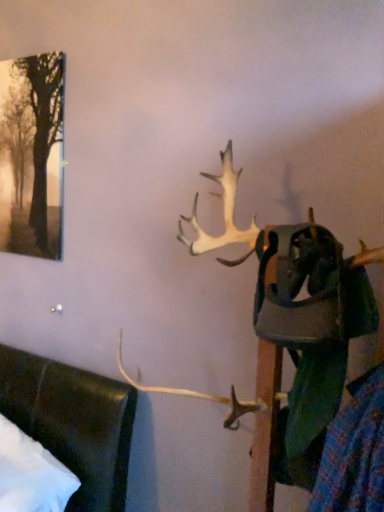
Find the location of a particular element. white antler at upper center is located at coordinates click(303, 320).

The width and height of the screenshot is (384, 512). What do you see at coordinates (303, 320) in the screenshot?
I see `white antler at upper center` at bounding box center [303, 320].

Describe the element at coordinates (43, 128) in the screenshot. I see `silvery metallic tree at upper left` at that location.

Locate an element on the screen. The height and width of the screenshot is (512, 384). silvery metallic tree at upper left is located at coordinates (43, 128).

What is the approximate width of silvery metallic tree at upper left?

silvery metallic tree at upper left is 5.65 centimeters wide.

At what (x,y) coordinates should I click in order to perform the action: click on white antler at upper center. Please return your answer as a coordinate pair (x, y). The width and height of the screenshot is (384, 512). Looking at the image, I should click on (303, 320).

Which is more to the left, white antler at upper center or silvery metallic tree at upper left?

Positioned to the left is silvery metallic tree at upper left.

Consider the image. Considering the positions of objects white antler at upper center and silvery metallic tree at upper left in the image provided, who is behind, white antler at upper center or silvery metallic tree at upper left?

silvery metallic tree at upper left.

Is point (196, 194) farther from camera compared to point (42, 161)?

No, it is not.

From the image's perspective, relative to silvery metallic tree at upper left, is white antler at upper center above or below?

white antler at upper center is situated lower than silvery metallic tree at upper left in the image.

From a real-world perspective, who is located lower, white antler at upper center or silvery metallic tree at upper left?

white antler at upper center.

In the scene shown: Does white antler at upper center have a lesser width compared to silvery metallic tree at upper left?

No.

Which of these two, white antler at upper center or silvery metallic tree at upper left, stands shorter?

Standing shorter between the two is silvery metallic tree at upper left.

Is white antler at upper center bigger or smaller than silvery metallic tree at upper left?

Answer: In the image, white antler at upper center appears to be larger than silvery metallic tree at upper left.

From the picture: Does white antler at upper center contain silvery metallic tree at upper left?

No, silvery metallic tree at upper left is not a part of white antler at upper center.

Is white antler at upper center not near silvery metallic tree at upper left?

That's right, there is a large distance between white antler at upper center and silvery metallic tree at upper left.

Is white antler at upper center facing towards silvery metallic tree at upper left?

No, white antler at upper center is not turned towards silvery metallic tree at upper left.

What's the angular difference between white antler at upper center and silvery metallic tree at upper left's facing directions?

The facing directions of white antler at upper center and silvery metallic tree at upper left are 0.00481 degrees apart.

How much distance is there between white antler at upper center and silvery metallic tree at upper left?

They are 1.02 meters apart.

At what (x,y) coordinates should I click in order to perform the action: click on tree behind the white antler at upper center. Please return your answer as a coordinate pair (x, y). Image resolution: width=384 pixels, height=512 pixels. Looking at the image, I should click on (43, 128).

Between silvery metallic tree at upper left and white antler at upper center, which one appears on the right side from the viewer's perspective?

From the viewer's perspective, white antler at upper center appears more on the right side.

Considering the positions of objects silvery metallic tree at upper left and white antler at upper center in the image provided, who is behind, silvery metallic tree at upper left or white antler at upper center?

Positioned behind is silvery metallic tree at upper left.

Does point (36, 137) come behind point (288, 311)?

Yes, it is behind point (288, 311).

From the image's perspective, is silvery metallic tree at upper left on white antler at upper center?

Yes, from the image's perspective, silvery metallic tree at upper left is on top of white antler at upper center.

From a real-world perspective, who is located lower, silvery metallic tree at upper left or white antler at upper center?

In real-world perspective, white antler at upper center is lower.

In the scene shown: Considering the sizes of objects silvery metallic tree at upper left and white antler at upper center in the image provided, who is thinner, silvery metallic tree at upper left or white antler at upper center?

silvery metallic tree at upper left.

Does silvery metallic tree at upper left have a greater height compared to white antler at upper center?

In fact, silvery metallic tree at upper left may be shorter than white antler at upper center.

Considering the sizes of objects silvery metallic tree at upper left and white antler at upper center in the image provided, who is bigger, silvery metallic tree at upper left or white antler at upper center?

white antler at upper center is bigger.

Is white antler at upper center surrounded by silvery metallic tree at upper left?

No, white antler at upper center is not inside silvery metallic tree at upper left.

Is silvery metallic tree at upper left next to white antler at upper center and touching it?

They are not placed beside each other.

Is silvery metallic tree at upper left looking in the opposite direction of white antler at upper center?

No, silvery metallic tree at upper left is not facing away from white antler at upper center.

Can you tell me how much silvery metallic tree at upper left and white antler at upper center differ in facing direction?

0.00481 degrees separate the facing orientations of silvery metallic tree at upper left and white antler at upper center.

Identify the location of tree behind the white antler at upper center. (43, 128).

You are a GUI agent. You are given a task and a screenshot of the screen. Output one action in this format:
    pyautogui.click(x=<x>, y=<y>)
    Task: Click on the deer that is below the silvery metallic tree at upper left (from the image's perspective)
    
    Given the screenshot: What is the action you would take?
    pyautogui.click(x=303, y=320)

I want to click on tree above the white antler at upper center (from the image's perspective), so click(x=43, y=128).